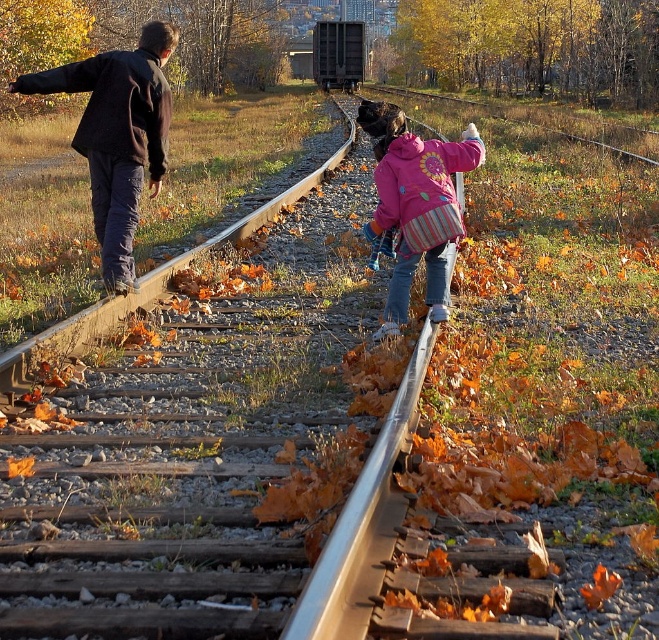
You are a parent watching your children playing near the railway tracks. You see the dark brown jacket at left and the pink fleece jacket at center. Which child is closer to you?

The pink fleece jacket at center is closer to you because the dark brown jacket at left is above it, indicating it is further away.

You are a photographer trying to capture the scene along the railway tracks. You notice a specific point at coordinates (117, 136). Based on the image description, what object is located at that point?

The point at coordinates (117, 136) is located on the dark brown jacket at left.

You are a photographer standing at the point closest to the camera. You want to take a photo of both point [154,26] and point [399,166] without moving your camera. Which point should you focus on first to ensure both are in the frame?

You should focus on point [154,26] first because it is closer to you than point [399,166], ensuring both points remain within the camera frame.